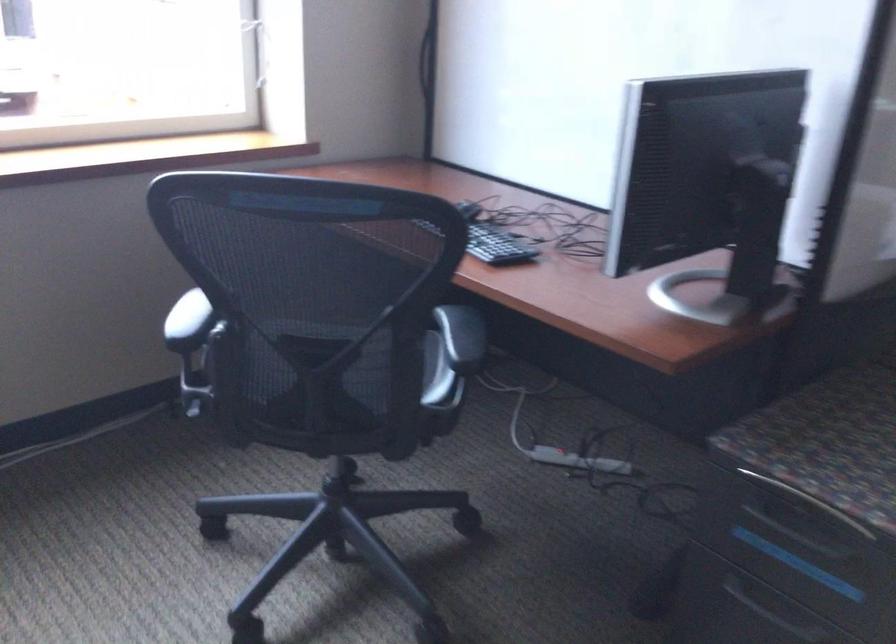
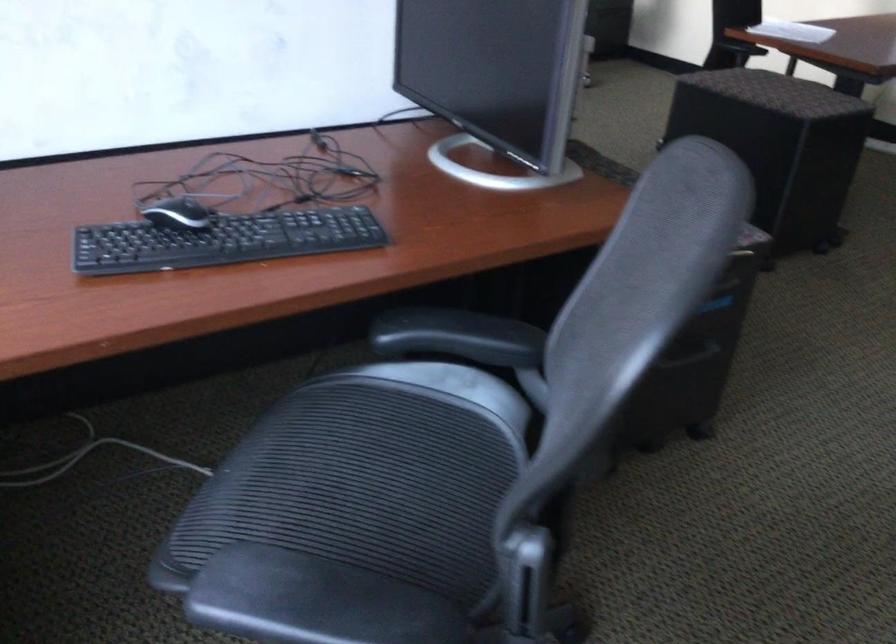
Locate, in the second image, the point that corresponds to pixel 451 326 in the first image.

(458, 337)